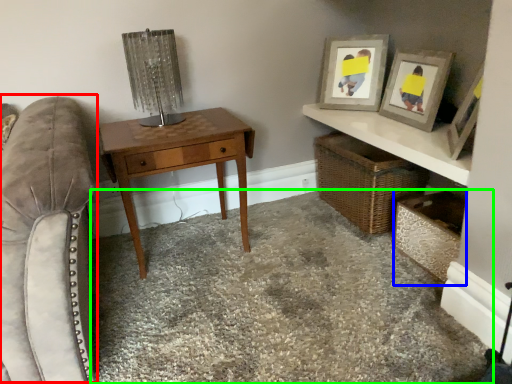
Question: Which object is positioned farthest from swivel chair (highlighted by a red box)? Select from shelf (highlighted by a blue box) and concrete (highlighted by a green box).

Choices:
 (A) shelf
 (B) concrete

Answer: (A)